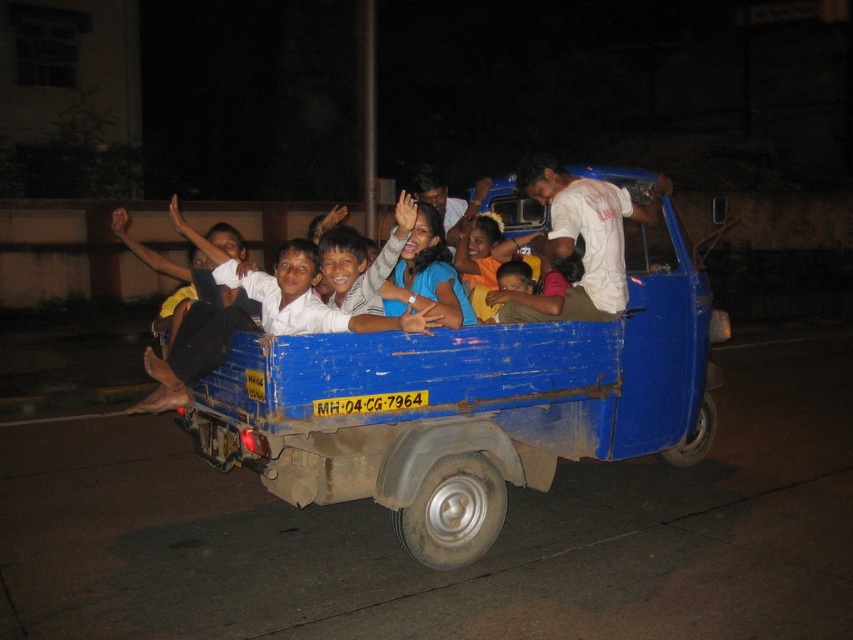
Is blue matte truck at center below white cotton shirt at upper center?

Correct, blue matte truck at center is located below white cotton shirt at upper center.

Measure the distance between blue matte truck at center and white cotton shirt at upper center.

blue matte truck at center and white cotton shirt at upper center are 30.63 inches apart.

The image size is (853, 640). What do you see at coordinates (469, 404) in the screenshot?
I see `blue matte truck at center` at bounding box center [469, 404].

At what (x,y) coordinates should I click in order to perform the action: click on blue matte truck at center. Please return your answer as a coordinate pair (x, y). This screenshot has height=640, width=853. Looking at the image, I should click on (469, 404).